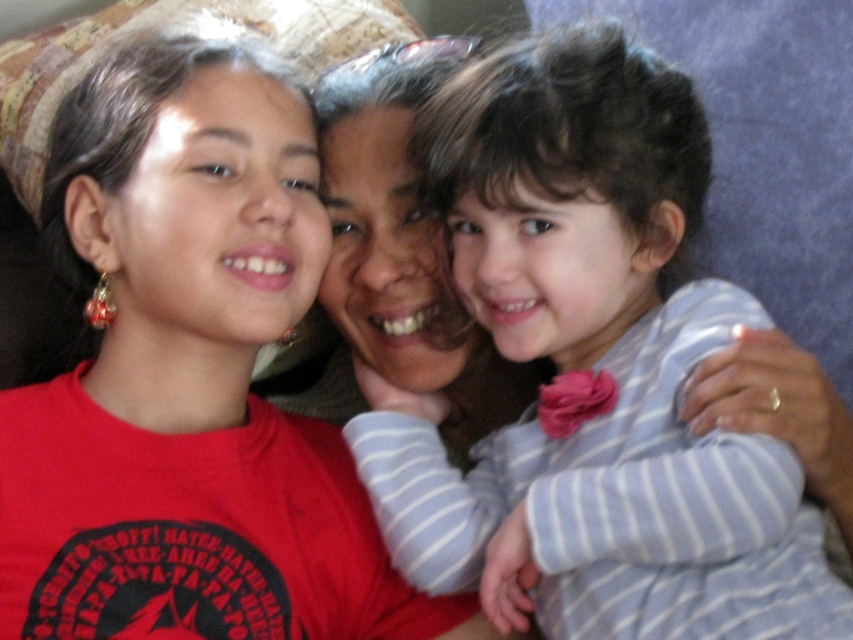
You are standing in the living room and want to place a new decorative pillow exactly where the striped fabric dress at center is currently located. According to the image, what are the coordinates of the location where you should place the pillow?

The coordinates for the location where the striped fabric dress at center is situated are at point (590, 369).

You are an interior designer assessing the seating arrangement for a family photo. You notice the striped fabric dress at center and the matte brown hair at center. Which one is covering the other?

The striped fabric dress at center is positioned over matte brown hair at center, so the dress is covering the hair.

You are standing in the living room and want to place a small decorative item between the two points, point (544, 548) and point (350, 609). Based on their positions, which point should the item be closer to in order to be centered between them?

To center the decorative item between point (544, 548) and point (350, 609), it should be placed closer to point (350, 609) since point (544, 548) is in front of it, meaning the distance between them requires the item to balance their positions.